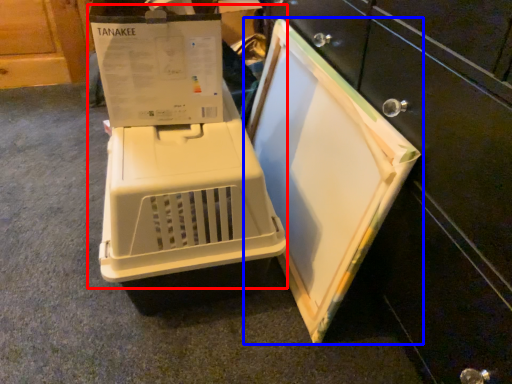
Question: Among these objects, which one is nearest to the camera, appliance (highlighted by a red box) or home appliance (highlighted by a blue box)?

Choices:
 (A) appliance
 (B) home appliance

Answer: (B)